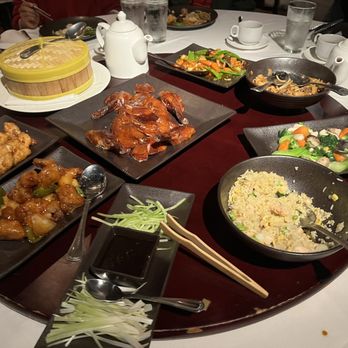
This screenshot has width=348, height=348. Find the location of `platter`. platter is located at coordinates (197, 166).